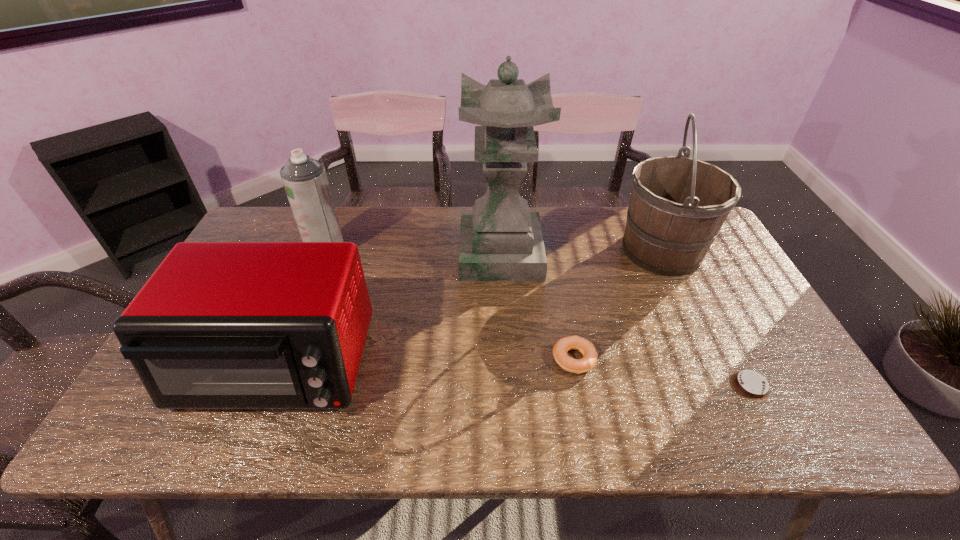
At what (x,y) coordinates should I click in order to perform the action: click on object that is at the near left corner. Please return your answer as a coordinate pair (x, y). The width and height of the screenshot is (960, 540). Looking at the image, I should click on (219, 325).

The image size is (960, 540). I want to click on object located at the far right corner, so click(678, 205).

Where is `free region at the far edge of the desktop`? free region at the far edge of the desktop is located at coordinates (377, 245).

Identify the location of free space at the near edge. This screenshot has height=540, width=960. click(622, 427).

I want to click on vacant space at the right edge of the desktop, so click(x=709, y=281).

In the image, there is a desktop. Identify the location of vacant space at the near left corner. This screenshot has width=960, height=540. (180, 421).

The width and height of the screenshot is (960, 540). In the image, there is a desktop. Find the location of `vacant space at the near right corner`. vacant space at the near right corner is located at coordinates (814, 440).

The image size is (960, 540). In order to click on free point between the chocolate cake and the tallest object in this screenshot , I will do `click(625, 320)`.

At what (x,y) coordinates should I click in order to perform the action: click on unoccupied position between the fifth tallest object and the fourth shortest object. Please return your answer as a coordinate pair (x, y). This screenshot has width=960, height=540. Looking at the image, I should click on (450, 306).

Find the location of a particular element. This screenshot has width=960, height=540. free space that is in between the sculpture and the aerosol can is located at coordinates (414, 253).